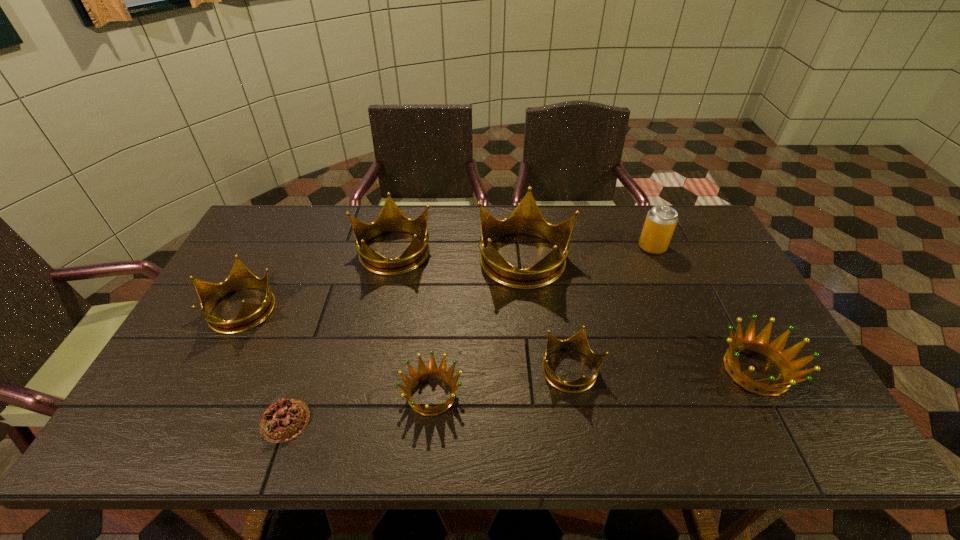
Locate an element on the screen. Image resolution: width=960 pixels, height=540 pixels. the left golden crown is located at coordinates (423, 373).

Find the location of a particular element. The width and height of the screenshot is (960, 540). the seventh tallest object is located at coordinates (423, 373).

Locate an element on the screen. The height and width of the screenshot is (540, 960). chocolate cake is located at coordinates (284, 420).

Image resolution: width=960 pixels, height=540 pixels. Find the location of `vacant space located 0.150m on the front of the biggest gold crown`. vacant space located 0.150m on the front of the biggest gold crown is located at coordinates (533, 331).

Locate an element on the screen. This screenshot has width=960, height=540. free space located 0.070m on the left of the second gold crown from left to right is located at coordinates (333, 251).

Locate an element on the screen. The width and height of the screenshot is (960, 540). free space located 0.170m on the front of the pop (soda) is located at coordinates (673, 294).

At what (x,y) coordinates should I click in order to perform the action: click on vacant point located on the right of the third biggest gold crown. Please return your answer as a coordinate pair (x, y). The image size is (960, 540). Looking at the image, I should click on (318, 308).

I want to click on free region located on the back of the bigger golden crown, so click(x=732, y=324).

At what (x,y) coordinates should I click in order to perform the action: click on vacant area situated on the left of the smallest gold crown. Please return your answer as a coordinate pair (x, y). Looking at the image, I should click on (478, 371).

This screenshot has width=960, height=540. Identify the location of free location located on the back of the left golden crown. (442, 282).